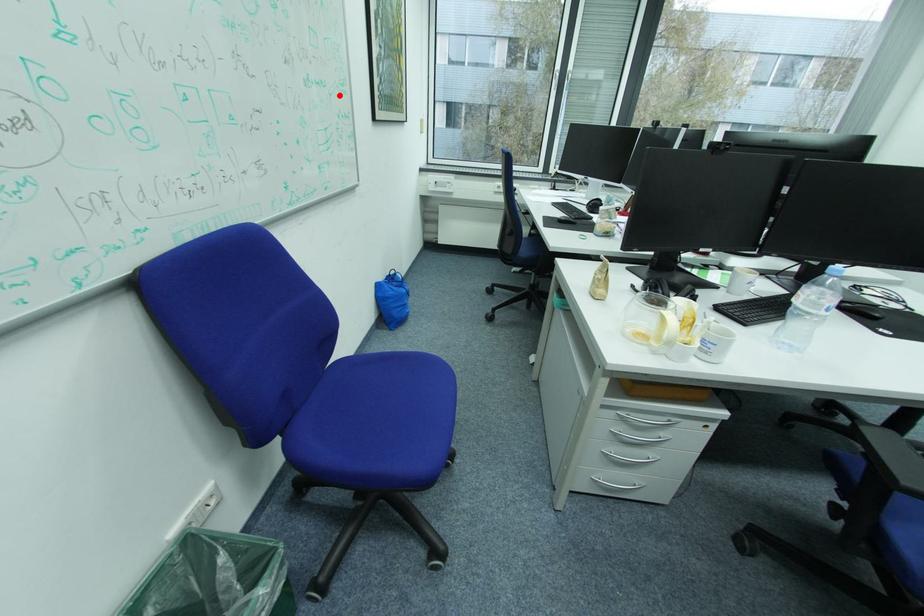
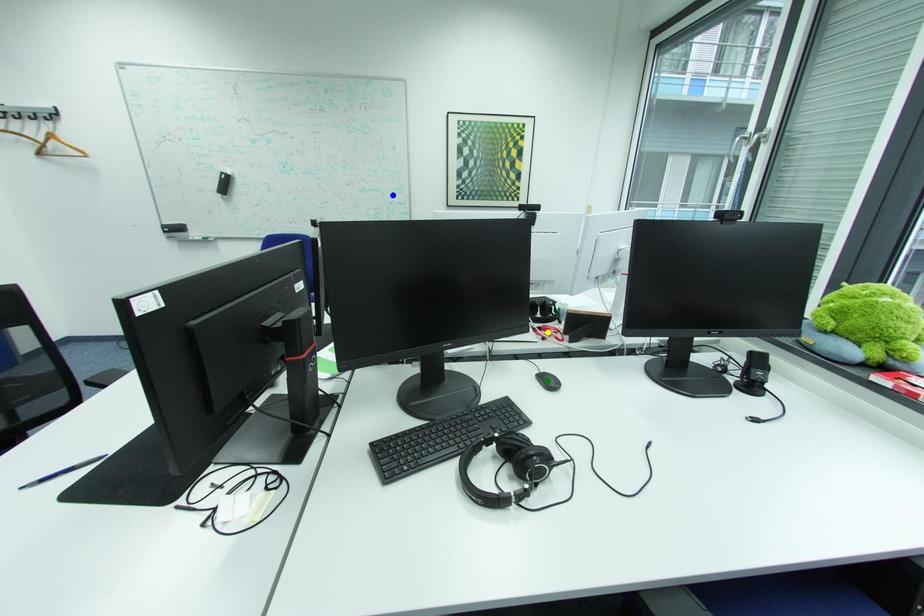
Question: I am providing you with two images of the same scene from different viewpoints. A red point is marked on the first image. You are given multiple points on the second image. Which point in image 2 represents the same 3d spot as the red point in image 1?

Choices:
 (A) yellow point
 (B) green point
 (C) blue point

Answer: (C)